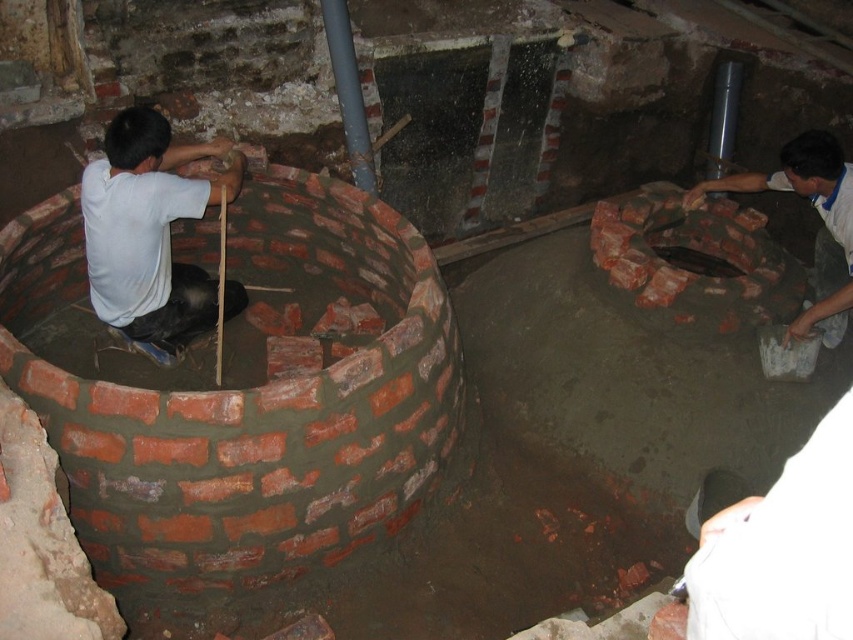
Is white matte shirt at left closer to camera compared to smooth concrete hole at center?

That is True.

Based on the photo, is white matte shirt at left wider than smooth concrete hole at center?

Yes.

Describe the element at coordinates (148, 225) in the screenshot. I see `white matte shirt at left` at that location.

Image resolution: width=853 pixels, height=640 pixels. In order to click on white matte shirt at left in this screenshot , I will do `click(148, 225)`.

Is white matte shirt at upper right above smooth concrete hole at center?

Yes.

The image size is (853, 640). I want to click on white matte shirt at upper right, so click(819, 227).

Identify the location of white matte shirt at upper right. (819, 227).

Does white matte shirt at left lie in front of white matte shirt at upper right?

Yes, it is in front of white matte shirt at upper right.

Locate an element on the screen. The height and width of the screenshot is (640, 853). white matte shirt at left is located at coordinates (148, 225).

I want to click on white matte shirt at left, so click(x=148, y=225).